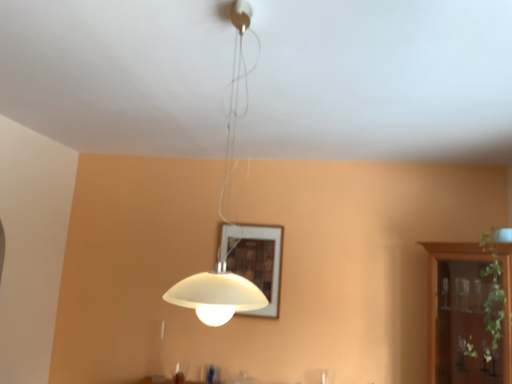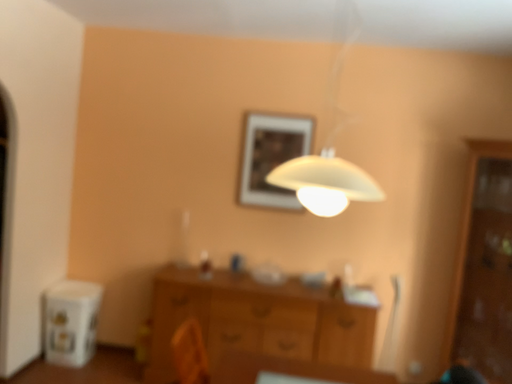
Question: How did the camera likely rotate when shooting the video?

Choices:
 (A) rotated downward
 (B) rotated upward

Answer: (A)